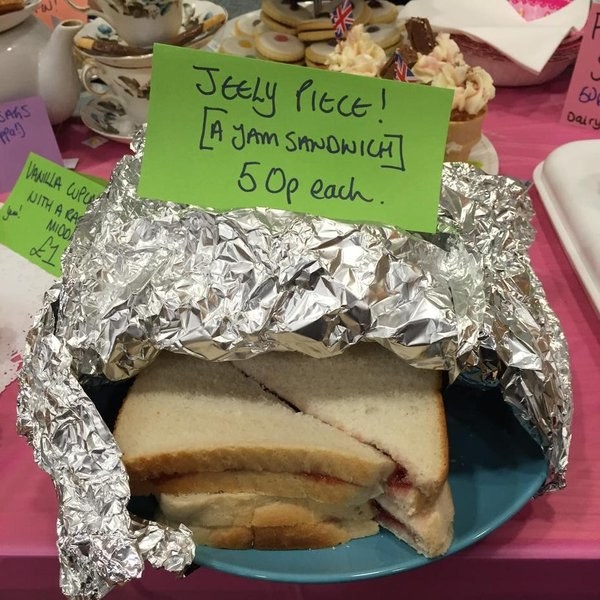
At what (x,y) coordinates should I click in order to perform the action: click on teapot. Please return your answer as a coordinate pair (x, y). This screenshot has width=600, height=600. Looking at the image, I should click on (25, 60).